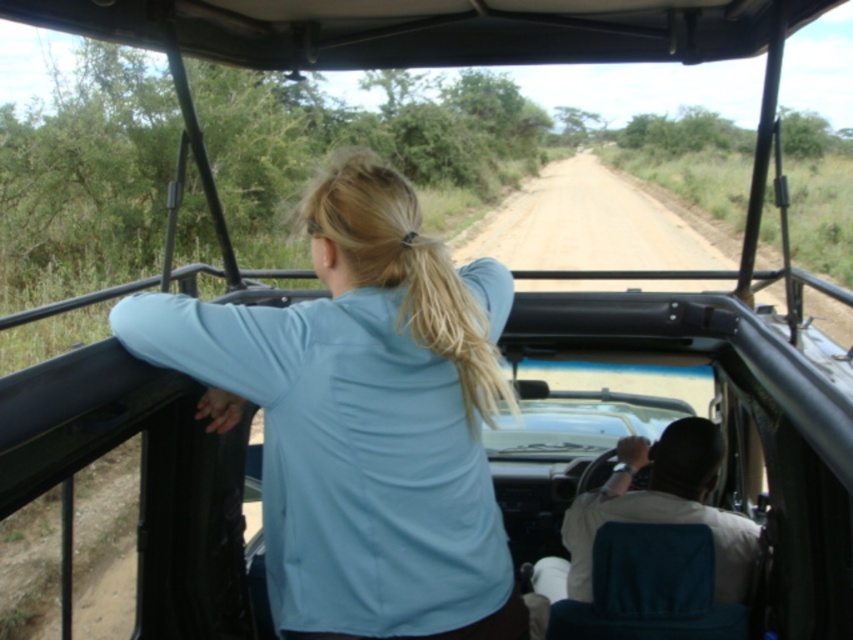
Between light blue fabric at center and white cotton shirt at center, which one appears on the left side from the viewer's perspective?

light blue fabric at center is more to the left.

Find the location of a particular element. The width and height of the screenshot is (853, 640). light blue fabric at center is located at coordinates (363, 419).

The height and width of the screenshot is (640, 853). In order to click on light blue fabric at center in this screenshot , I will do `click(363, 419)`.